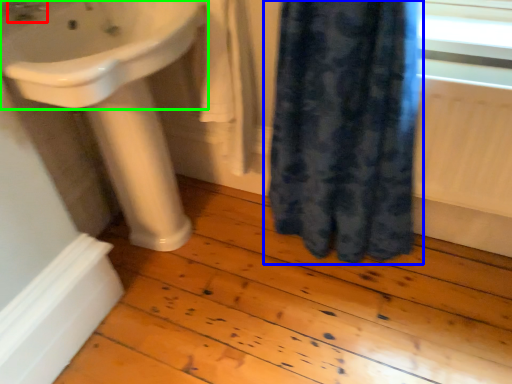
Question: Which is farther away from tap (highlighted by a red box)? curtain (highlighted by a blue box) or sink (highlighted by a green box)?

Choices:
 (A) curtain
 (B) sink

Answer: (A)